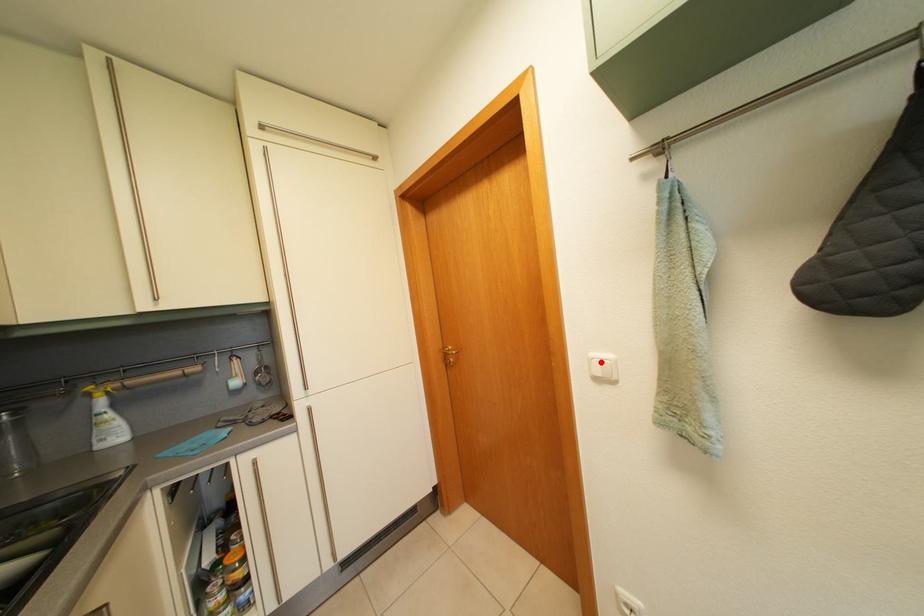
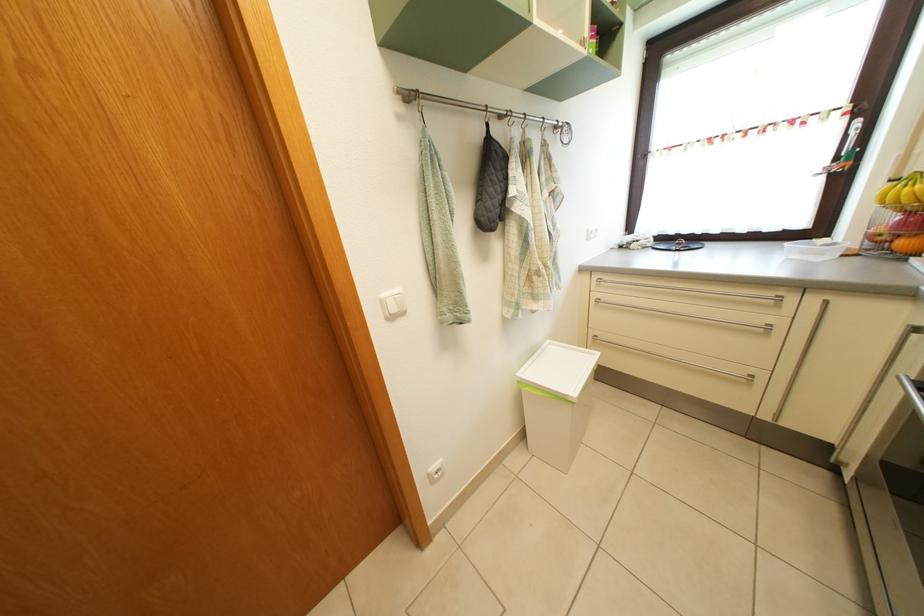
Locate, in the second image, the point that corresponds to the highlighted location in the first image.

(392, 302)